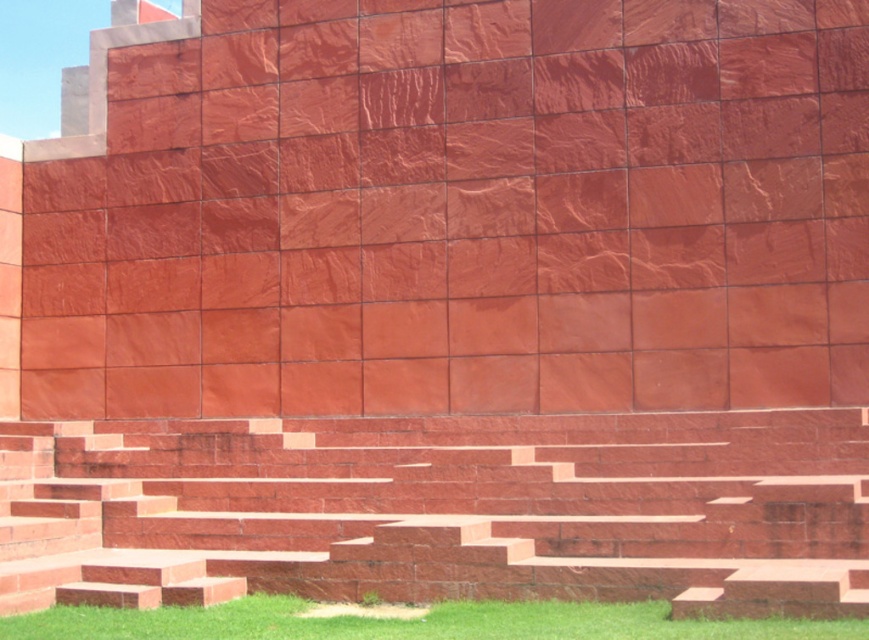
You are standing in front of the matte red stone wall at center and the green grass at lower center. Which object is taller?

The matte red stone wall at center is much taller than the green grass at lower center.

You are standing in front of the matte red stone wall at center and want to walk towards the polished red stone stairs at center. Which direction should you move to get closer to the stairs?

Since the matte red stone wall at center is closer to you than the polished red stone stairs at center, you should move away from the wall towards the direction of the stairs to get closer to them.

You are standing at the bottom of the polished red stone stairs at center and want to walk to the green grass at lower center. Is the path between them wide enough for you to walk comfortably?

The polished red stone stairs at center might be wider than green grass at lower center, so the path between them could be wide enough for comfortable walking.